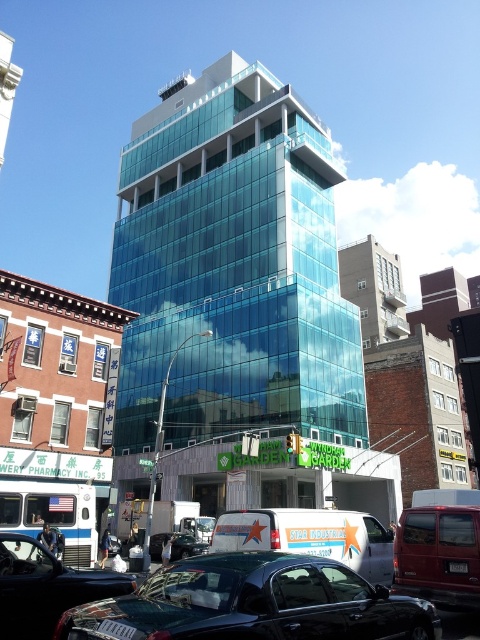
Is transparent glass building at center shorter than metallic silver van at center?

No.

Which is above, transparent glass building at center or metallic silver van at center?

transparent glass building at center

Which is in front, point (165, 291) or point (193, 538)?

Point (193, 538) is more forward.

The width and height of the screenshot is (480, 640). In order to click on transparent glass building at center in this screenshot , I will do `click(229, 280)`.

Between shiny black sedan at lower left and metallic red van at lower right, which one is positioned higher?

shiny black sedan at lower left

Can you confirm if shiny black sedan at lower left is thinner than metallic red van at lower right?

No.

Find the location of a particular element. The width and height of the screenshot is (480, 640). shiny black sedan at lower left is located at coordinates (253, 604).

Based on the photo, is the position of shiny black sedan at lower left less distant than that of shiny black car at lower left?

Yes, it is.

Which of these two, shiny black sedan at lower left or shiny black car at lower left, stands taller?

shiny black sedan at lower left is taller.

Who is more distant from viewer, (237, 598) or (12, 637)?

Positioned behind is point (12, 637).

Locate an element on the screen. The image size is (480, 640). shiny black sedan at lower left is located at coordinates (253, 604).